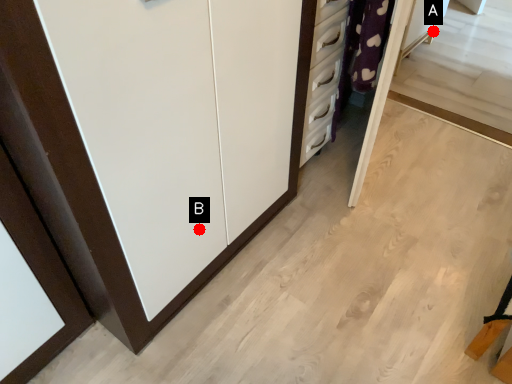
Question: Two points are circled on the image, labeled by A and B beside each circle. Which point is closer to the camera?

Choices:
 (A) A is closer
 (B) B is closer

Answer: (B)